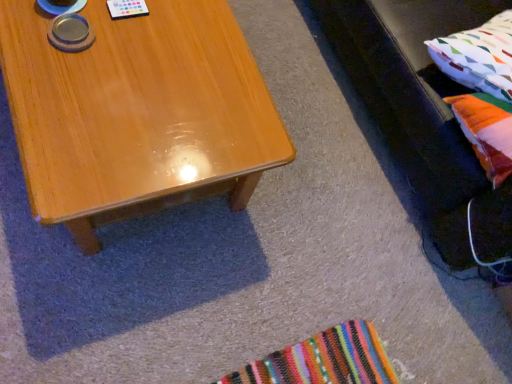
This screenshot has width=512, height=384. In order to click on velvet black couch at right in this screenshot , I will do `click(422, 112)`.

Is point (484, 120) in front of point (226, 116)?

That is False.

Can you confirm if multicolored fabric pillow at right, the first pillow when ordered from bottom to top, is wider than shiny wood coffee table at center?

In fact, multicolored fabric pillow at right, the first pillow when ordered from bottom to top, might be narrower than shiny wood coffee table at center.

Is multicolored fabric pillow at right, placed as the 2th pillow when sorted from top to bottom, touching shiny wood coffee table at center?

No, multicolored fabric pillow at right, placed as the 2th pillow when sorted from top to bottom, is not in contact with shiny wood coffee table at center.

In the scene shown: Is multicolored fabric pillow at right, the first pillow when ordered from bottom to top, aimed at shiny wood coffee table at center?

No, multicolored fabric pillow at right, the first pillow when ordered from bottom to top, is not oriented towards shiny wood coffee table at center.

Would you say multicolored fabric pillow at right, placed as the 2th pillow when sorted from top to bottom, is a long distance from multicolored fabric pillow at right, which appears as the first pillow when viewed from the top?

multicolored fabric pillow at right, placed as the 2th pillow when sorted from top to bottom, is actually quite close to multicolored fabric pillow at right, which appears as the first pillow when viewed from the top.

What's the angular difference between multicolored fabric pillow at right, placed as the 2th pillow when sorted from top to bottom, and multicolored fabric pillow at right, which is the second pillow in bottom-to-top order,'s facing directions?

9.64 degrees separate the facing orientations of multicolored fabric pillow at right, placed as the 2th pillow when sorted from top to bottom, and multicolored fabric pillow at right, which is the second pillow in bottom-to-top order.

At what (x,y) coordinates should I click in order to perform the action: click on pillow on the right of multicolored fabric pillow at right, placed as the 2th pillow when sorted from top to bottom. Please return your answer as a coordinate pair (x, y). The image size is (512, 384). Looking at the image, I should click on (478, 56).

Between multicolored fabric pillow at right, the first pillow when ordered from bottom to top, and multicolored fabric pillow at right, which appears as the first pillow when viewed from the top, which one has smaller width?

Thinner between the two is multicolored fabric pillow at right, the first pillow when ordered from bottom to top.

From the image's perspective, between velvet black couch at right and multicolored fabric pillow at right, which appears as the first pillow when viewed from the top, which one is located above?

velvet black couch at right is shown above in the image.

Which object is more forward, velvet black couch at right or multicolored fabric pillow at right, which is the second pillow in bottom-to-top order?

velvet black couch at right is more forward.

From the picture: Which point is more forward, (384, 56) or (488, 40)?

The point (488, 40) is more forward.

From the image's perspective, is multicolored fabric pillow at right, which appears as the first pillow when viewed from the top, above or below shiny wood coffee table at center?

Clearly, from the image's perspective, multicolored fabric pillow at right, which appears as the first pillow when viewed from the top, is above shiny wood coffee table at center.

Between multicolored fabric pillow at right, which appears as the first pillow when viewed from the top, and shiny wood coffee table at center, which one is positioned in front?

shiny wood coffee table at center is more forward.

In the image, there is a multicolored fabric pillow at right, which appears as the first pillow when viewed from the top. Identify the location of coffee table below it (from the image's perspective). This screenshot has height=384, width=512. (137, 113).

Would you consider multicolored fabric pillow at right, which appears as the first pillow when viewed from the top, to be distant from shiny wood coffee table at center?

They are positioned close to each other.

Which is correct: velvet black couch at right is inside shiny wood coffee table at center, or outside of it?

velvet black couch at right is outside shiny wood coffee table at center.

Consider the image. Considering the relative positions of velvet black couch at right and shiny wood coffee table at center in the image provided, is velvet black couch at right to the right of shiny wood coffee table at center from the viewer's perspective?

Yes, velvet black couch at right is to the right of shiny wood coffee table at center.

I want to click on coffee table on the left of velvet black couch at right, so click(x=137, y=113).

Based on the photo, is velvet black couch at right looking in the opposite direction of shiny wood coffee table at center?

No, shiny wood coffee table at center is not at the back of velvet black couch at right.

Which is more to the right, velvet black couch at right or multicolored fabric pillow at right, placed as the 2th pillow when sorted from top to bottom?

velvet black couch at right.

Is velvet black couch at right not close to multicolored fabric pillow at right, placed as the 2th pillow when sorted from top to bottom?

velvet black couch at right is near multicolored fabric pillow at right, placed as the 2th pillow when sorted from top to bottom, not far away.

Is velvet black couch at right wider or thinner than multicolored fabric pillow at right, placed as the 2th pillow when sorted from top to bottom?

Considering their sizes, velvet black couch at right looks broader than multicolored fabric pillow at right, placed as the 2th pillow when sorted from top to bottom.

From a real-world perspective, is velvet black couch at right located beneath multicolored fabric pillow at right, placed as the 2th pillow when sorted from top to bottom?

Yes.

From a real-world perspective, is multicolored fabric pillow at right, which appears as the first pillow when viewed from the top, over multicolored fabric pillow at right, the first pillow when ordered from bottom to top?

Correct, in the physical world, multicolored fabric pillow at right, which appears as the first pillow when viewed from the top, is higher than multicolored fabric pillow at right, the first pillow when ordered from bottom to top.

Locate an element on the screen. The height and width of the screenshot is (384, 512). pillow below the multicolored fabric pillow at right, which is the second pillow in bottom-to-top order (from the image's perspective) is located at coordinates (486, 131).

Which of these two, multicolored fabric pillow at right, which appears as the first pillow when viewed from the top, or multicolored fabric pillow at right, the first pillow when ordered from bottom to top, is smaller?

With smaller size is multicolored fabric pillow at right, the first pillow when ordered from bottom to top.

Considering the positions of objects multicolored fabric pillow at right, which is the second pillow in bottom-to-top order, and multicolored fabric pillow at right, placed as the 2th pillow when sorted from top to bottom, in the image provided, who is more to the left, multicolored fabric pillow at right, which is the second pillow in bottom-to-top order, or multicolored fabric pillow at right, placed as the 2th pillow when sorted from top to bottom,?

multicolored fabric pillow at right, placed as the 2th pillow when sorted from top to bottom.

Image resolution: width=512 pixels, height=384 pixels. In order to click on pillow below the shiny wood coffee table at center (from the image's perspective) in this screenshot , I will do `click(486, 131)`.

Identify the location of pillow in front of the multicolored fabric pillow at right, which appears as the first pillow when viewed from the top. (486, 131).

When comparing their distances from multicolored fabric pillow at right, which appears as the first pillow when viewed from the top, does shiny wood coffee table at center or multicolored fabric pillow at right, placed as the 2th pillow when sorted from top to bottom, seem closer?

The object closer to multicolored fabric pillow at right, which appears as the first pillow when viewed from the top, is multicolored fabric pillow at right, placed as the 2th pillow when sorted from top to bottom.

Which object lies further to the anchor point velvet black couch at right, shiny wood coffee table at center or multicolored fabric pillow at right, which is the second pillow in bottom-to-top order?

Among the two, shiny wood coffee table at center is located further to velvet black couch at right.

Based on their spatial positions, is multicolored fabric pillow at right, which appears as the first pillow when viewed from the top, or velvet black couch at right closer to shiny wood coffee table at center?

velvet black couch at right lies closer to shiny wood coffee table at center than the other object.

Estimate the real-world distances between objects in this image. Which object is further from shiny wood coffee table at center, velvet black couch at right or multicolored fabric pillow at right, which appears as the first pillow when viewed from the top?

multicolored fabric pillow at right, which appears as the first pillow when viewed from the top, is positioned further to the anchor shiny wood coffee table at center.

Looking at the image, which one is located further to shiny wood coffee table at center, multicolored fabric pillow at right, which is the second pillow in bottom-to-top order, or multicolored fabric pillow at right, placed as the 2th pillow when sorted from top to bottom?

multicolored fabric pillow at right, placed as the 2th pillow when sorted from top to bottom, is further to shiny wood coffee table at center.

Considering their positions, is multicolored fabric pillow at right, placed as the 2th pillow when sorted from top to bottom, positioned further to multicolored fabric pillow at right, which is the second pillow in bottom-to-top order, than velvet black couch at right?

velvet black couch at right.

Considering their positions, is multicolored fabric pillow at right, placed as the 2th pillow when sorted from top to bottom, positioned further to shiny wood coffee table at center than velvet black couch at right?

Among the two, multicolored fabric pillow at right, placed as the 2th pillow when sorted from top to bottom, is located further to shiny wood coffee table at center.

From the picture: When comparing their distances from multicolored fabric pillow at right, the first pillow when ordered from bottom to top, does multicolored fabric pillow at right, which is the second pillow in bottom-to-top order, or shiny wood coffee table at center seem closer?

Based on the image, multicolored fabric pillow at right, which is the second pillow in bottom-to-top order, appears to be nearer to multicolored fabric pillow at right, the first pillow when ordered from bottom to top.

What are the coordinates of `pillow that lies between velvet black couch at right and multicolored fabric pillow at right, the first pillow when ordered from bottom to top, from top to bottom` in the screenshot? It's located at (478, 56).

The height and width of the screenshot is (384, 512). In order to click on pillow located between shiny wood coffee table at center and multicolored fabric pillow at right, which is the second pillow in bottom-to-top order, in the left-right direction in this screenshot , I will do `click(486, 131)`.